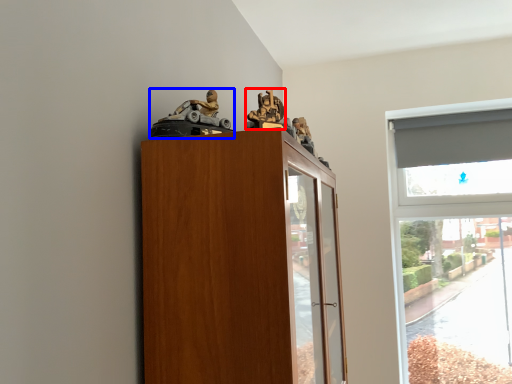
Question: Which object is further to the camera taking this photo, toy (highlighted by a red box) or toy (highlighted by a blue box)?

Choices:
 (A) toy
 (B) toy

Answer: (A)